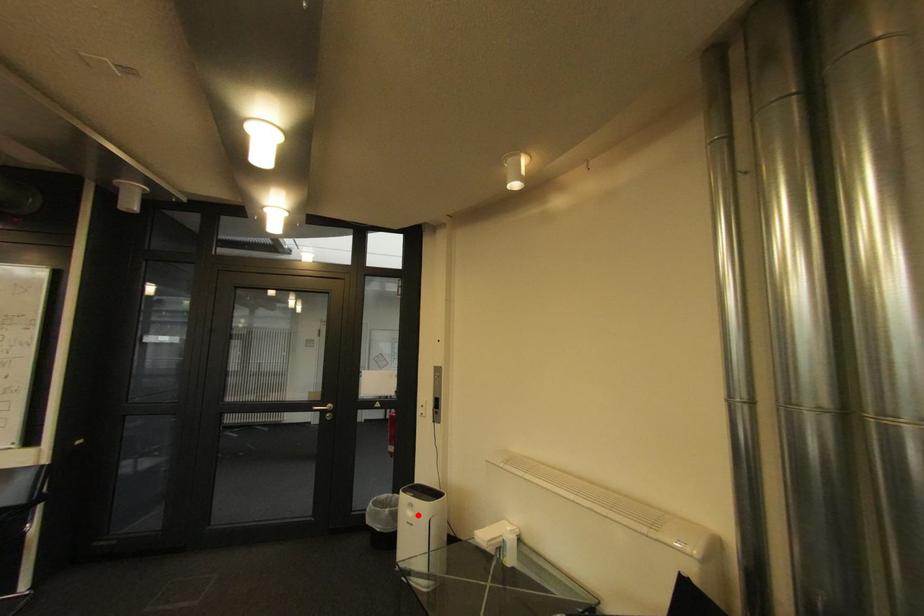
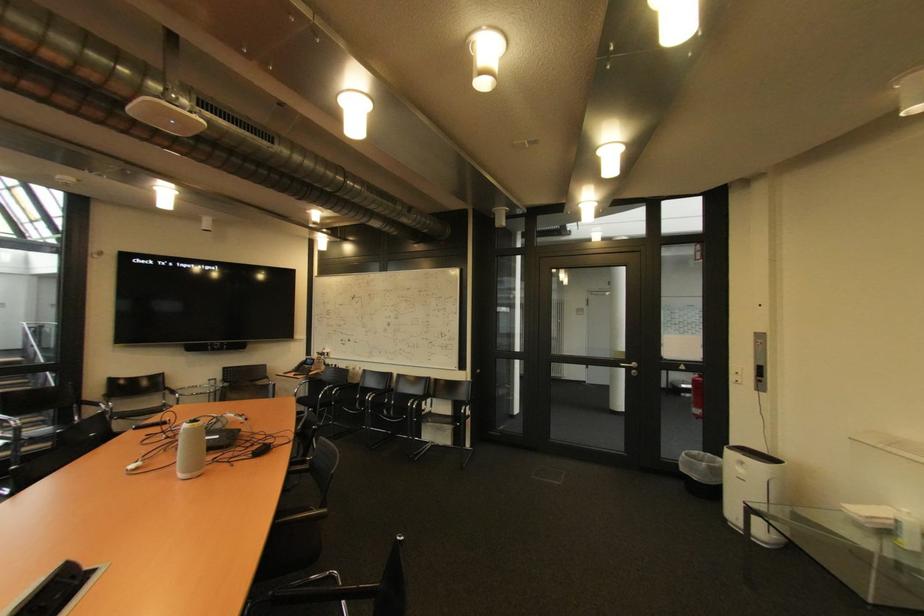
Question: I am providing you with two images of the same scene from different viewpoints. In image1, a red point is highlighted. Considering the same 3D point in image2, which of the following is correct?

Choices:
 (A) It is closer
 (B) It is farther

Answer: (A)